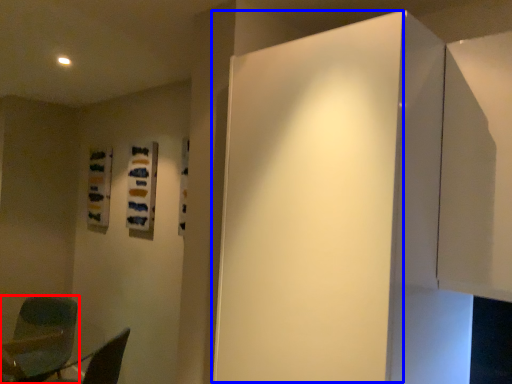
Question: Which point is further to the camera, chair (highlighted by a red box) or door (highlighted by a blue box)?

Choices:
 (A) chair
 (B) door

Answer: (A)